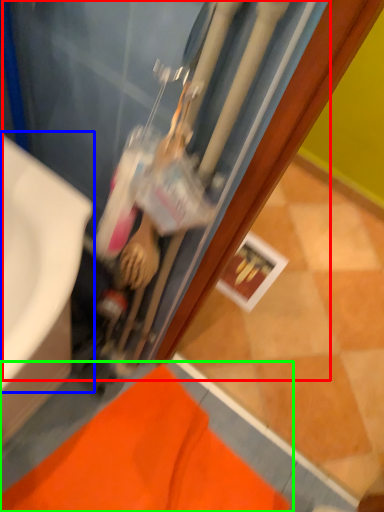
Question: Estimate the real-world distances between objects in this image. Which object is farther from water heater (highlighted by a red box), sink (highlighted by a blue box) or bath mat (highlighted by a green box)?

Choices:
 (A) sink
 (B) bath mat

Answer: (B)